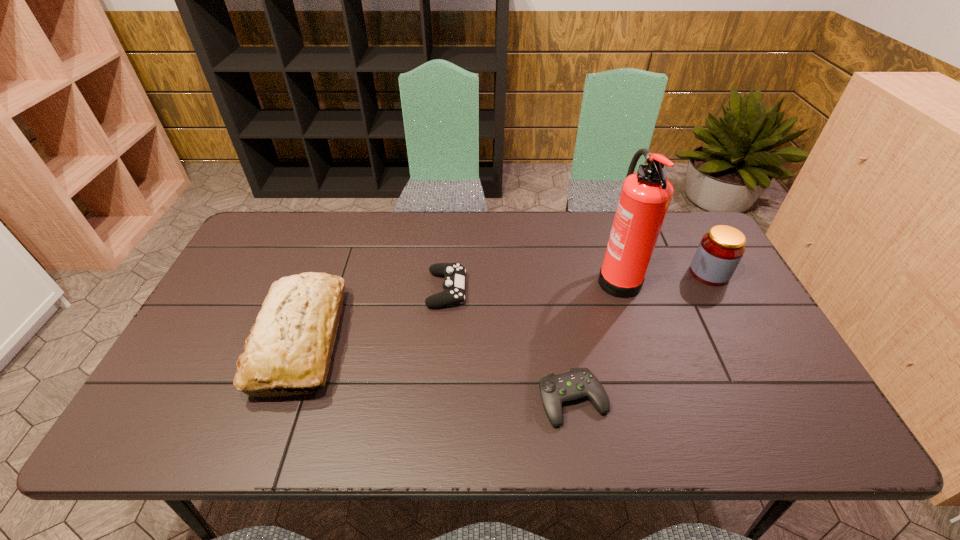
The width and height of the screenshot is (960, 540). Identify the location of vacant space located at the nozzle of the tallest object. (520, 276).

Where is `vacant space located 0.050m on the left of the rightmost object`? This screenshot has height=540, width=960. vacant space located 0.050m on the left of the rightmost object is located at coordinates (674, 273).

Find the location of a particular element. free region located on the back of the bread is located at coordinates (342, 230).

This screenshot has height=540, width=960. What are the coordinates of `vacant space situated on the surface of the taller control` in the screenshot? It's located at (578, 289).

Find the location of a particular element. The width and height of the screenshot is (960, 540). free space located 0.150m on the left of the right control is located at coordinates (475, 400).

The image size is (960, 540). Find the location of `object that is at the far edge`. object that is at the far edge is located at coordinates (645, 196).

Identify the location of object that is at the near edge. (555, 389).

Find the location of a particular element. object that is at the right edge is located at coordinates (720, 250).

In the image, there is a desktop. Where is `vacant space at the far edge`? The height and width of the screenshot is (540, 960). vacant space at the far edge is located at coordinates (329, 224).

I want to click on vacant space at the near edge of the desktop, so click(x=595, y=430).